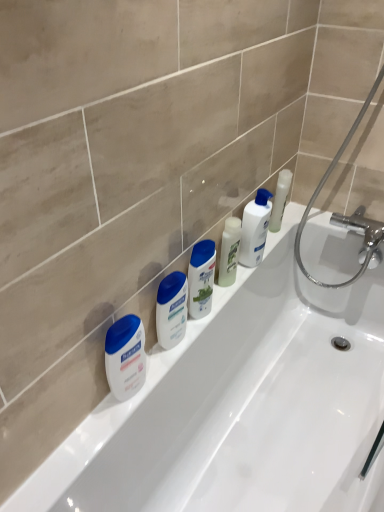
Question: Can you confirm if white glossy lotion at upper center, which appears as the 3th toiletry when viewed from the left, is wider than white plastic shampoo bottle at center, positioned as the 2th toiletry in left-to-right order?

Choices:
 (A) yes
 (B) no

Answer: (A)

Question: Is white glossy lotion at upper center, acting as the first toiletry starting from the right, positioned far away from white plastic shampoo bottle at center, the 2th toiletry in the right-to-left sequence?

Choices:
 (A) yes
 (B) no

Answer: (B)

Question: Can you confirm if white glossy lotion at upper center, acting as the first toiletry starting from the right, is bigger than white plastic shampoo bottle at center, positioned as the 2th toiletry in left-to-right order?

Choices:
 (A) no
 (B) yes

Answer: (B)

Question: From the image's perspective, would you say white glossy lotion at upper center, acting as the first toiletry starting from the right, is shown under white plastic shampoo bottle at center, the 2th toiletry in the right-to-left sequence?

Choices:
 (A) no
 (B) yes

Answer: (A)

Question: From a real-world perspective, is white glossy lotion at upper center, acting as the first toiletry starting from the right, located higher than white plastic shampoo bottle at center, the 2th toiletry in the right-to-left sequence?

Choices:
 (A) yes
 (B) no

Answer: (A)

Question: Looking at their shapes, would you say white plastic shampoo bottle at center, the 2th toiletry in the right-to-left sequence, is wider or thinner than chrome metallic shower at upper right?

Choices:
 (A) wide
 (B) thin

Answer: (B)

Question: Considering their positions, is white plastic shampoo bottle at center, positioned as the 2th toiletry in left-to-right order, located in front of or behind chrome metallic shower at upper right?

Choices:
 (A) front
 (B) behind

Answer: (B)

Question: From the image's perspective, relative to chrome metallic shower at upper right, is white plastic shampoo bottle at center, the 2th toiletry in the right-to-left sequence, above or below?

Choices:
 (A) below
 (B) above

Answer: (A)

Question: Is white plastic shampoo bottle at center, positioned as the 2th toiletry in left-to-right order, inside the boundaries of chrome metallic shower at upper right, or outside?

Choices:
 (A) outside
 (B) inside

Answer: (A)

Question: Is white matte lotion at left wider or thinner than white glossy bathtub at center?

Choices:
 (A) thin
 (B) wide

Answer: (A)

Question: From a real-world perspective, is white matte lotion at left above or below white glossy bathtub at center?

Choices:
 (A) above
 (B) below

Answer: (A)

Question: Would you say white matte lotion at left is to the left or to the right of white glossy bathtub at center in the picture?

Choices:
 (A) right
 (B) left

Answer: (B)

Question: From the image's perspective, is white matte lotion at left positioned above or below white glossy bathtub at center?

Choices:
 (A) above
 (B) below

Answer: (A)

Question: Based on their positions, is white glossy lotion at upper center, acting as the first toiletry starting from the right, located to the left or right of white glossy lotion at center, the 1th toiletry in the left-to-right sequence?

Choices:
 (A) right
 (B) left

Answer: (A)

Question: Is white glossy lotion at upper center, acting as the first toiletry starting from the right, wider or thinner than white glossy lotion at center, which is counted as the third toiletry, starting from the right?

Choices:
 (A) wide
 (B) thin

Answer: (A)